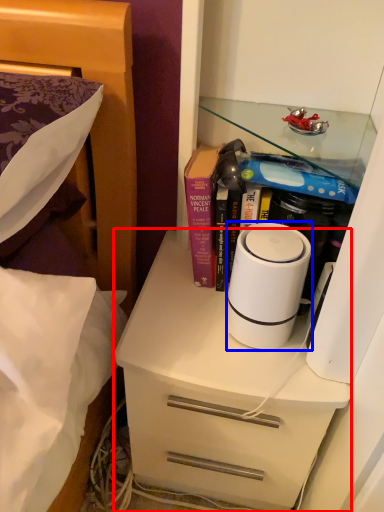
Question: Which object appears closest to the camera in this image, chest of drawers (highlighted by a red box) or home appliance (highlighted by a blue box)?

Choices:
 (A) chest of drawers
 (B) home appliance

Answer: (B)